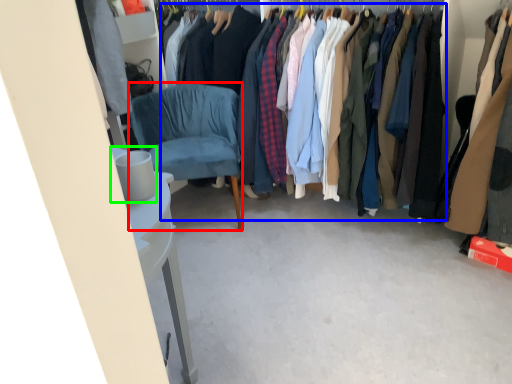
Question: Which is farther away from chair (highlighted by a red box)? clothing (highlighted by a blue box) or trash bin/can (highlighted by a green box)?

Choices:
 (A) clothing
 (B) trash bin/can

Answer: (B)